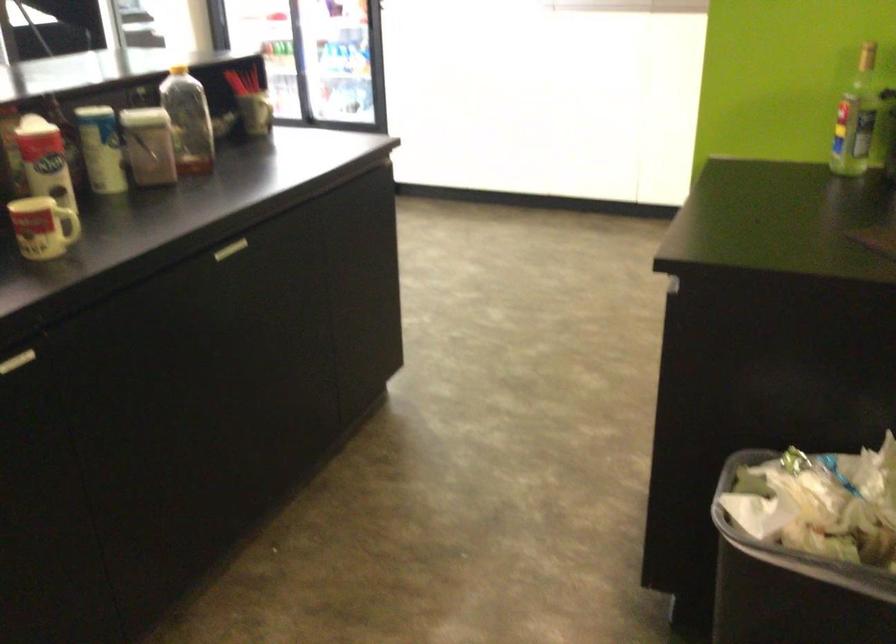
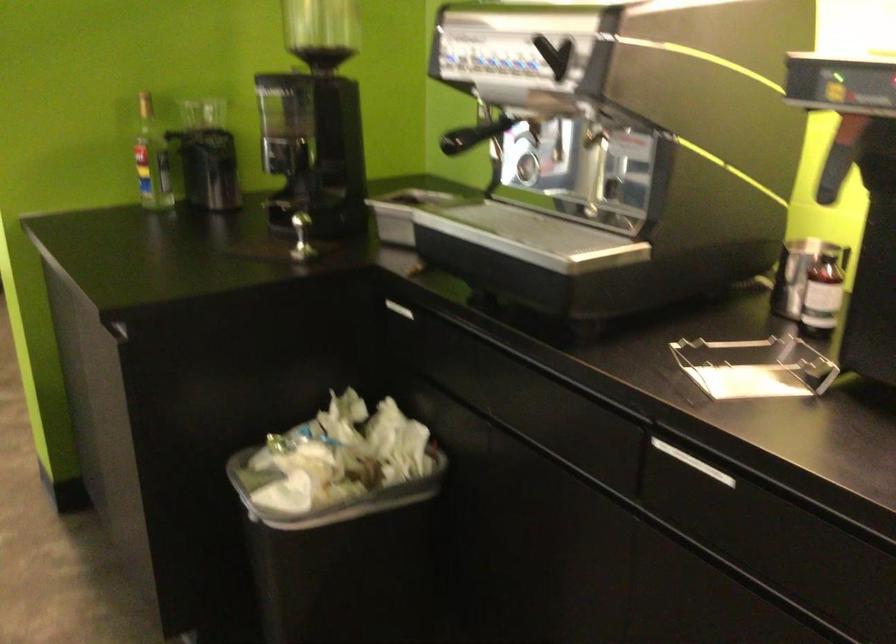
Find the pixel in the second image that matches (820,540) in the first image.

(328, 495)